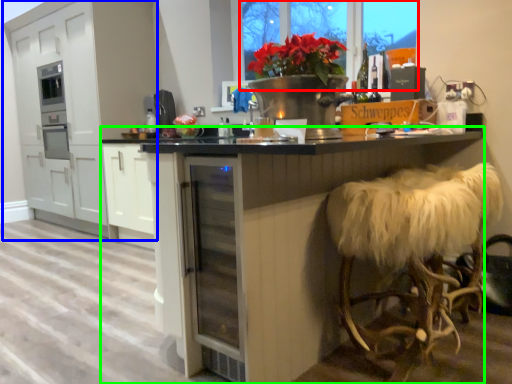
Question: Based on their relative distances, which object is nearer to window screen (highlighted by a red box)? Choose from cabinetry (highlighted by a blue box) and table (highlighted by a green box).

Choices:
 (A) cabinetry
 (B) table

Answer: (B)